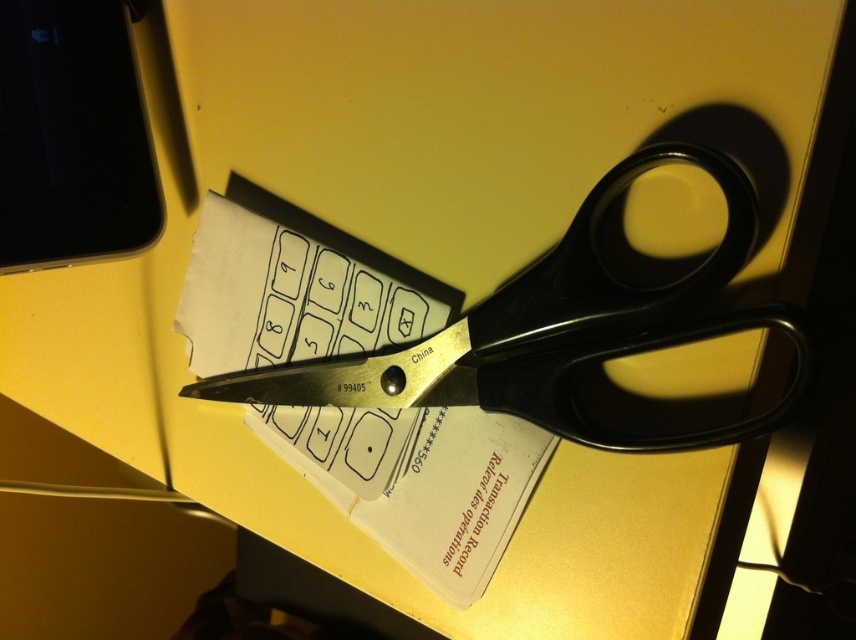
Question: Can you confirm if white paper at center is thinner than black plastic scissors at center?

Choices:
 (A) no
 (B) yes

Answer: (B)

Question: Which object appears farthest from the camera in this image?

Choices:
 (A) white paper at center
 (B) black plastic scissors at center

Answer: (A)

Question: Is white paper at center bigger than black plastic scissors at center?

Choices:
 (A) no
 (B) yes

Answer: (A)

Question: Does white paper at center have a smaller size compared to black plastic scissors at center?

Choices:
 (A) no
 (B) yes

Answer: (B)

Question: Which object is closer to the camera taking this photo?

Choices:
 (A) black plastic scissors at center
 (B) white paper at center

Answer: (A)